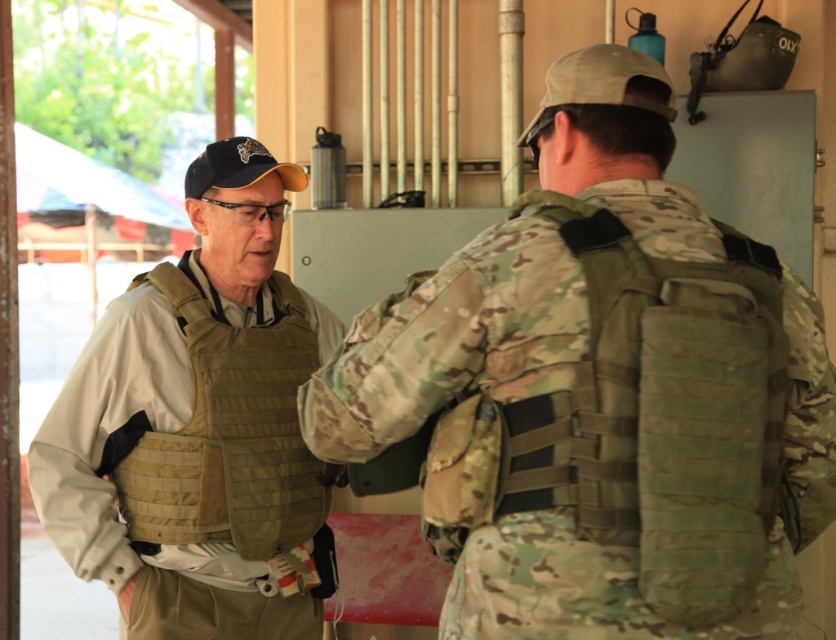
Question: Can you confirm if camouflage fabric vest at back is bigger than tan/khaki fabric vest at center?

Choices:
 (A) no
 (B) yes

Answer: (A)

Question: Which point is closer to the camera taking this photo?

Choices:
 (A) (269, 284)
 (B) (602, 371)
 (C) (82, 492)

Answer: (B)

Question: Which is farther from the camouflage fabric vest at back?

Choices:
 (A) tan fabric vest at left
 (B) tan/khaki fabric vest at center
 (C) camouflage fabric vest at center

Answer: (A)

Question: From the image, what is the correct spatial relationship of tan fabric vest at left in relation to tan/khaki fabric vest at center?

Choices:
 (A) below
 (B) above

Answer: (B)

Question: Which of the following is the closest to the observer?

Choices:
 (A) 319,502
 (B) 594,161
 (C) 758,384
 (D) 116,595

Answer: (C)

Question: Does camouflage fabric vest at center have a smaller size compared to camouflage fabric vest at back?

Choices:
 (A) yes
 (B) no

Answer: (B)